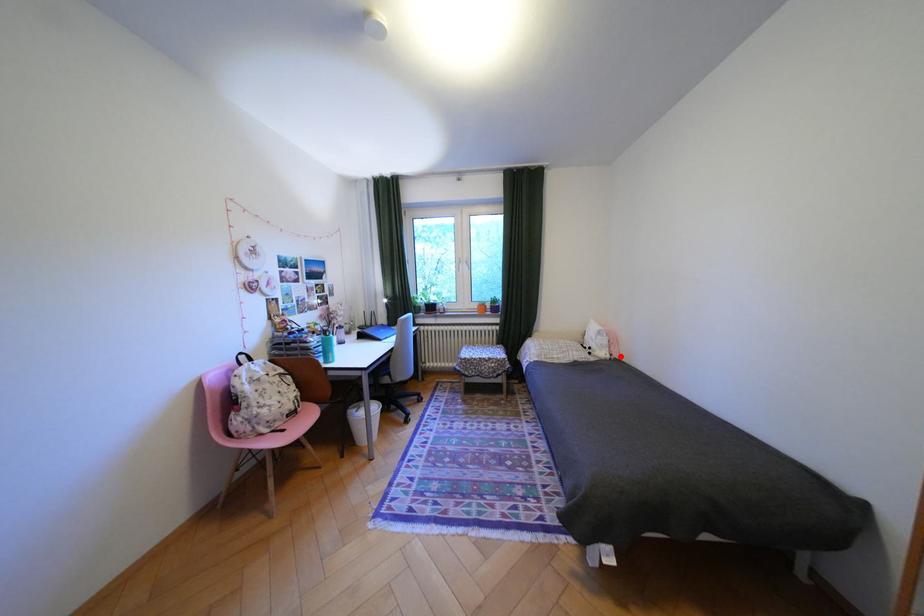
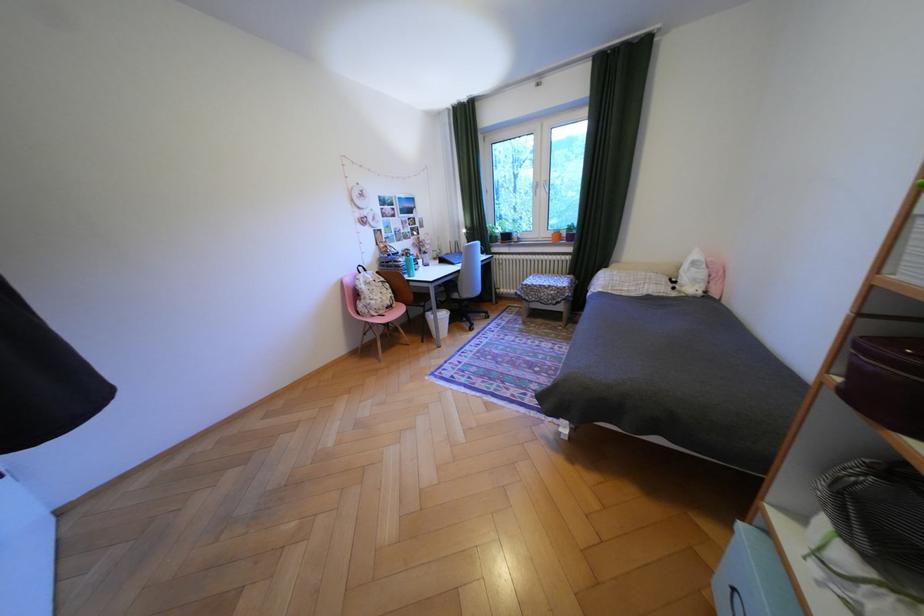
In the second image, find the point that corresponds to the highlighted location in the first image.

(712, 293)